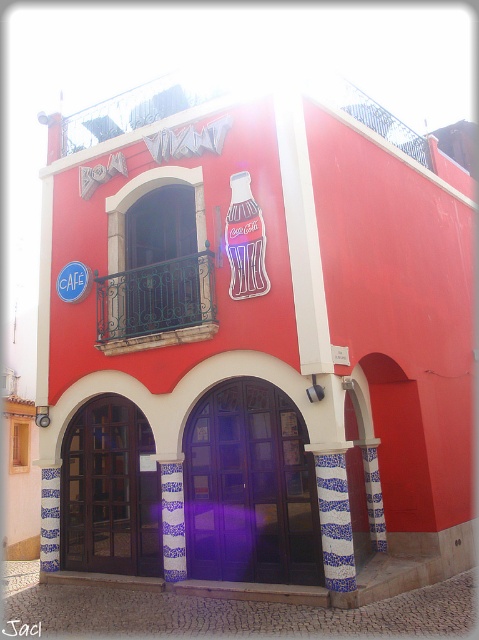
You are standing in front of the building and want to locate the purple wooden door at center. According to the coordinates provided, where exactly is it positioned?

The purple wooden door at center is located at the coordinates point [250,488].

You are a customer looking for the cafe entrance. You see the blue and white ceramic pillar at center and the blue plastic cafe sign at upper left. Which object is located higher up on the building?

The blue plastic cafe sign at upper left is located higher up on the building than the blue and white ceramic pillar at center.

You are a customer standing in front of the building and want to find the entrance. You see the blue and white ceramic pillar at center and the blue plastic cafe sign at upper left. Which object is closer to the ground?

The blue plastic cafe sign at upper left is closer to the ground because the blue and white ceramic pillar at center is taller than it.